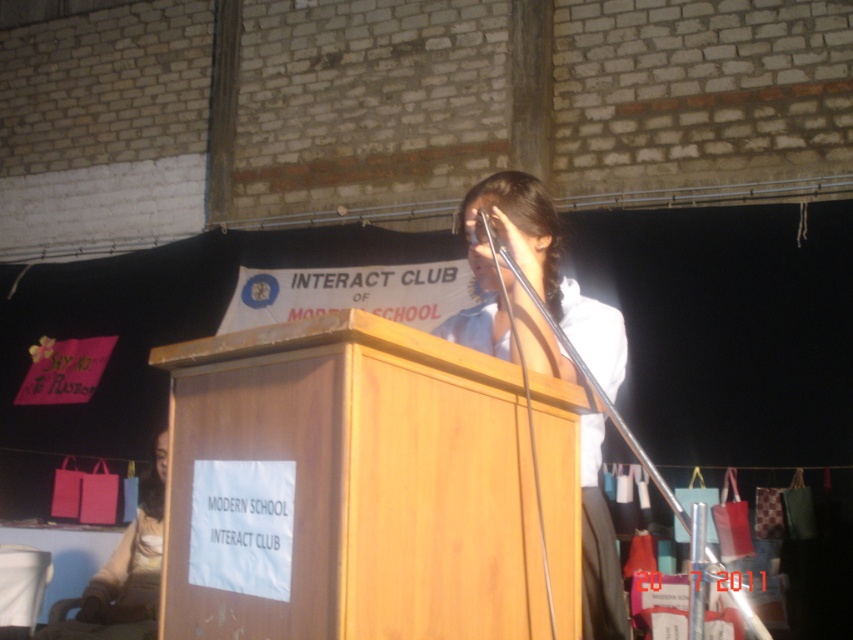
You are attending a school event and see the white glossy shirt at center and the metallic shiny microphone at upper center. Which object is closer to you?

The white glossy shirt at center is closer to you because it is in front of the metallic shiny microphone at upper center.

You are standing in front of the podium at the event. There are two points marked on the banner. Which point, point 1 at coordinates (x=605, y=352) or point 2 at coordinates (x=479, y=241), is closer to you?

Point 1 at coordinates (x=605, y=352) is closer to the viewer than point 2 at coordinates (x=479, y=241).